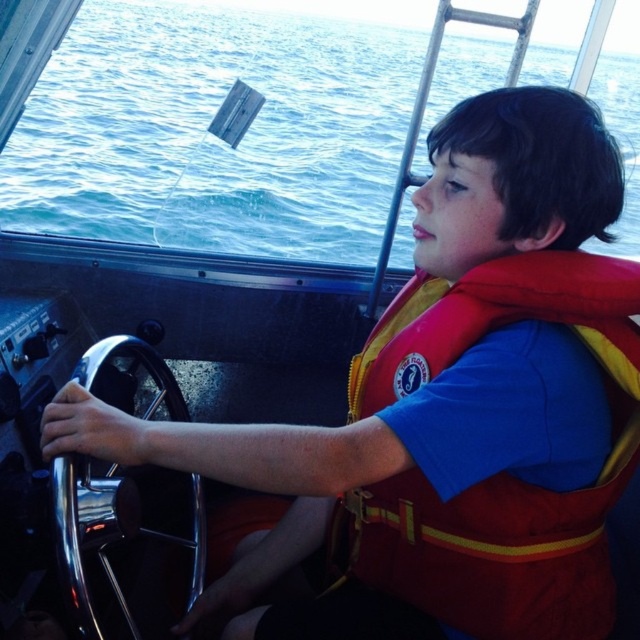
Does point (349, 132) come farther from viewer compared to point (81, 508)?

Yes, point (349, 132) is behind point (81, 508).

Which is below, blue water at upper left or polished chrome steering wheel at center?

polished chrome steering wheel at center

Describe the element at coordinates (209, 134) in the screenshot. I see `blue water at upper left` at that location.

You are a GUI agent. You are given a task and a screenshot of the screen. Output one action in this format:
    pyautogui.click(x=<x>, y=<y>)
    Task: Click on the blue water at upper left
    
    Given the screenshot: What is the action you would take?
    pyautogui.click(x=209, y=134)

Is red/yellow fabric life vest at center smaller than polished chrome steering wheel at center?

Incorrect, red/yellow fabric life vest at center is not smaller in size than polished chrome steering wheel at center.

Can you confirm if red/yellow fabric life vest at center is bigger than polished chrome steering wheel at center?

Yes, red/yellow fabric life vest at center is bigger than polished chrome steering wheel at center.

Locate an element on the screen. red/yellow fabric life vest at center is located at coordinates (500, 472).

Measure the distance between point (227, 208) and camera.

Point (227, 208) is 4.84 meters from camera.

Between blue water at upper left and red/yellow fabric life vest at center, which one appears on the left side from the viewer's perspective?

Positioned to the left is red/yellow fabric life vest at center.

You are a GUI agent. You are given a task and a screenshot of the screen. Output one action in this format:
    pyautogui.click(x=<x>, y=<y>)
    Task: Click on the blue water at upper left
    
    Given the screenshot: What is the action you would take?
    pyautogui.click(x=209, y=134)